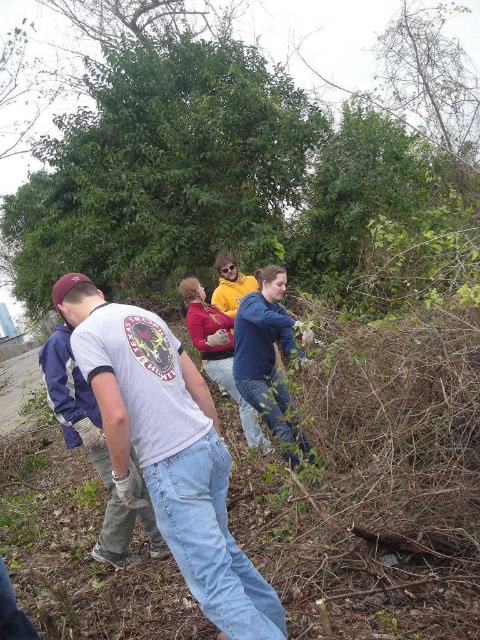
Locate an element on the screen. This screenshot has height=640, width=480. white cotton t-shirt at center is located at coordinates (168, 451).

Who is lower down, white cotton t-shirt at center or green leafy tree at center?

white cotton t-shirt at center is below.

Does point (215, 436) come closer to viewer compared to point (12, 150)?

Yes, point (215, 436) is closer to viewer.

Find the location of `white cotton t-shirt at center`. white cotton t-shirt at center is located at coordinates (168, 451).

Can you confirm if green leafy tree at center is positioned to the left of matte yellow sweater at center?

Correct, you'll find green leafy tree at center to the left of matte yellow sweater at center.

Between point (50, 108) and point (192, 337), which one is positioned in front?

Point (192, 337)

This screenshot has width=480, height=640. I want to click on green leafy tree at center, so click(320, 38).

Does white cotton t-shirt at center appear on the right side of blue denim jeans at center?

No, white cotton t-shirt at center is not to the right of blue denim jeans at center.

Does white cotton t-shirt at center appear on the left side of blue denim jeans at center?

Yes, white cotton t-shirt at center is to the left of blue denim jeans at center.

The width and height of the screenshot is (480, 640). I want to click on white cotton t-shirt at center, so click(168, 451).